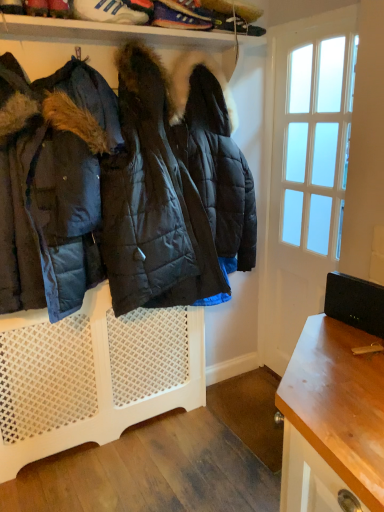
Question: Does white mesh radiator at center have a smaller size compared to shiny leather sneaker at upper left?

Choices:
 (A) no
 (B) yes

Answer: (A)

Question: Is white mesh radiator at center outside shiny leather sneaker at upper left?

Choices:
 (A) no
 (B) yes

Answer: (B)

Question: From the image's perspective, does white mesh radiator at center appear lower than shiny leather sneaker at upper left?

Choices:
 (A) yes
 (B) no

Answer: (A)

Question: Considering the relative sizes of white mesh radiator at center and shiny leather sneaker at upper left in the image provided, is white mesh radiator at center wider than shiny leather sneaker at upper left?

Choices:
 (A) yes
 (B) no

Answer: (B)

Question: From a real-world perspective, is white mesh radiator at center under shiny leather sneaker at upper left?

Choices:
 (A) no
 (B) yes

Answer: (B)

Question: In terms of width, does white mesh radiator at center look wider or thinner when compared to white suede sneakers at upper center, arranged as the 2th footwear when viewed from the right?

Choices:
 (A) thin
 (B) wide

Answer: (B)

Question: From the image's perspective, is white mesh radiator at center above or below white suede sneakers at upper center, arranged as the 2th footwear when viewed from the right?

Choices:
 (A) below
 (B) above

Answer: (A)

Question: From a real-world perspective, is white mesh radiator at center positioned above or below white suede sneakers at upper center, arranged as the 2th footwear when viewed from the right?

Choices:
 (A) below
 (B) above

Answer: (A)

Question: Considering their positions, is white mesh radiator at center located in front of or behind white suede sneakers at upper center, arranged as the 2th footwear when viewed from the right?

Choices:
 (A) front
 (B) behind

Answer: (B)

Question: Which is correct: white suede sneakers at upper center, arranged as the 2th footwear when viewed from the right, is inside white mesh radiator at center, or outside of it?

Choices:
 (A) inside
 (B) outside

Answer: (B)

Question: Considering the positions of white suede sneakers at upper center, which is the 1th footwear in left-to-right order, and white mesh radiator at center in the image, is white suede sneakers at upper center, which is the 1th footwear in left-to-right order, bigger or smaller than white mesh radiator at center?

Choices:
 (A) small
 (B) big

Answer: (A)

Question: From the image's perspective, relative to white mesh radiator at center, is white suede sneakers at upper center, which is the 1th footwear in left-to-right order, above or below?

Choices:
 (A) below
 (B) above

Answer: (B)

Question: Does point (77, 2) appear closer or farther from the camera than point (145, 310)?

Choices:
 (A) closer
 (B) farther

Answer: (A)

Question: From their relative heights in the image, would you say shiny leather sneaker at upper left is taller or shorter than white suede sneakers at upper center, arranged as the 2th footwear when viewed from the right?

Choices:
 (A) short
 (B) tall

Answer: (A)

Question: From the image's perspective, is shiny leather sneaker at upper left above or below white suede sneakers at upper center, arranged as the 2th footwear when viewed from the right?

Choices:
 (A) below
 (B) above

Answer: (A)